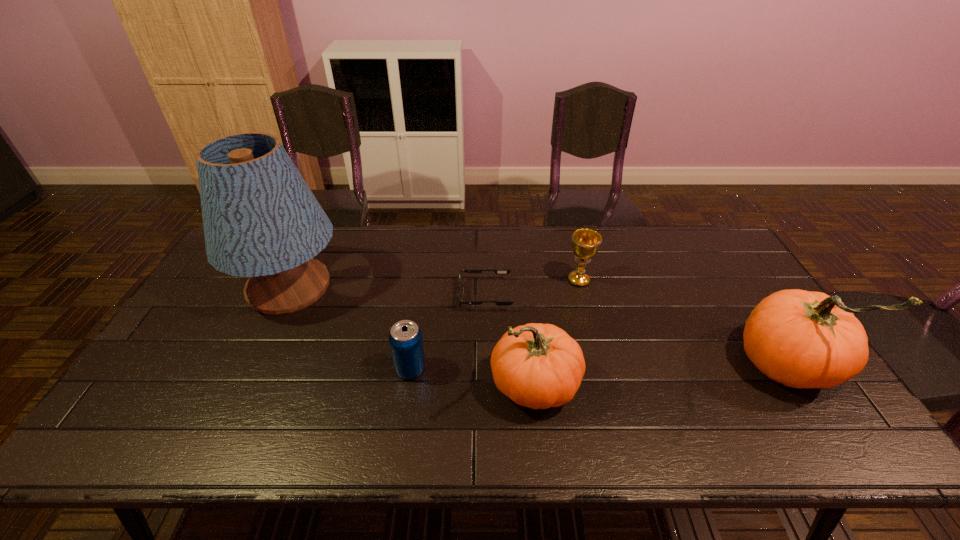
You are a GUI agent. You are given a task and a screenshot of the screen. Output one action in this format:
    pyautogui.click(x=<x>, y=<y>)
    Task: Click on the shorter pumpkin
    This screenshot has width=960, height=540.
    Given the screenshot: What is the action you would take?
    pyautogui.click(x=539, y=366)

Where is `the left pumpkin`? This screenshot has height=540, width=960. the left pumpkin is located at coordinates (539, 366).

You are a GUI agent. You are given a task and a screenshot of the screen. Output one action in this format:
    pyautogui.click(x=<x>, y=<y>)
    Task: Click on the taller pumpkin
    
    Given the screenshot: What is the action you would take?
    pyautogui.click(x=801, y=339)

Image resolution: width=960 pixels, height=540 pixels. Find the location of `the rightmost object`. the rightmost object is located at coordinates [801, 339].

Identify the location of chalice. This screenshot has width=960, height=540. (585, 242).

The width and height of the screenshot is (960, 540). Identify the location of the shortest object. [497, 271].

This screenshot has height=540, width=960. I want to click on pop soda, so click(405, 338).

Locate an element on the screen. the second shortest object is located at coordinates (405, 338).

This screenshot has height=540, width=960. Identify the location of lampshade. (261, 220).

Find the location of `the leftmost object`. the leftmost object is located at coordinates (261, 220).